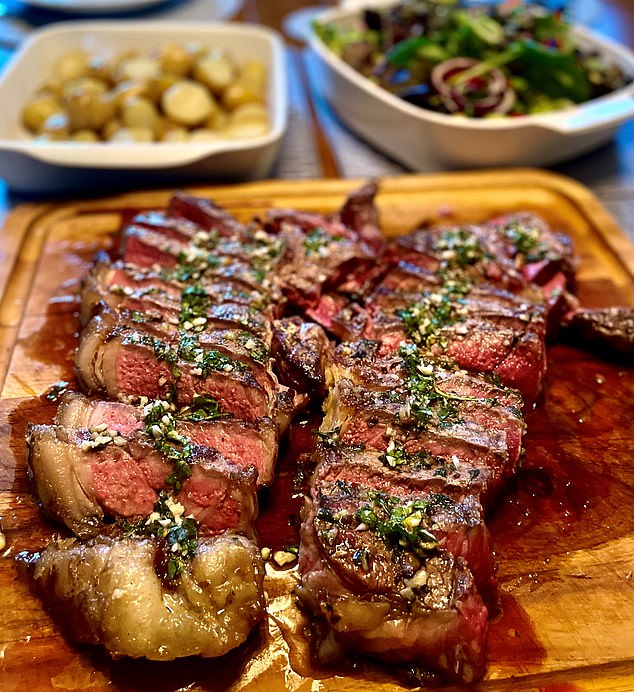
The height and width of the screenshot is (692, 634). I want to click on white dish top left, so click(x=133, y=161).